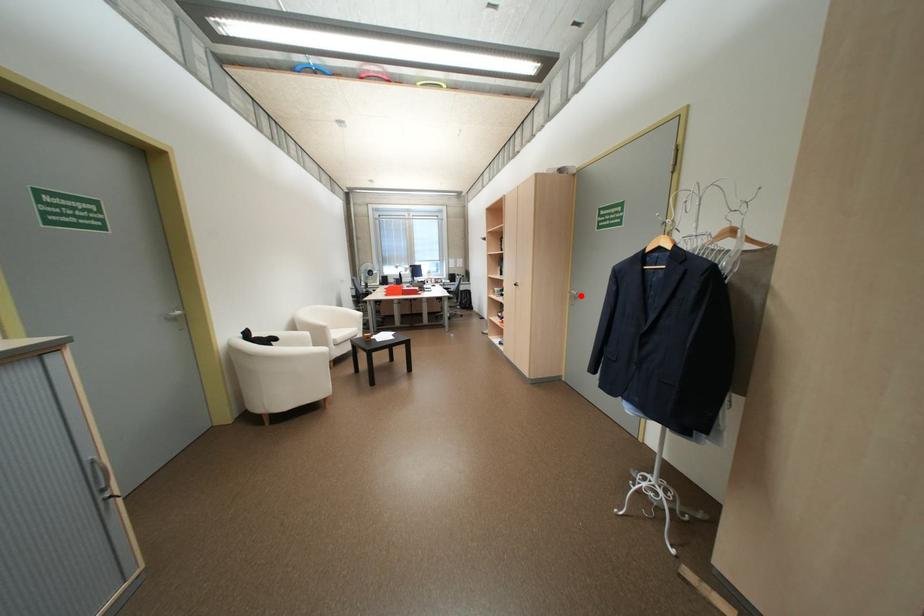
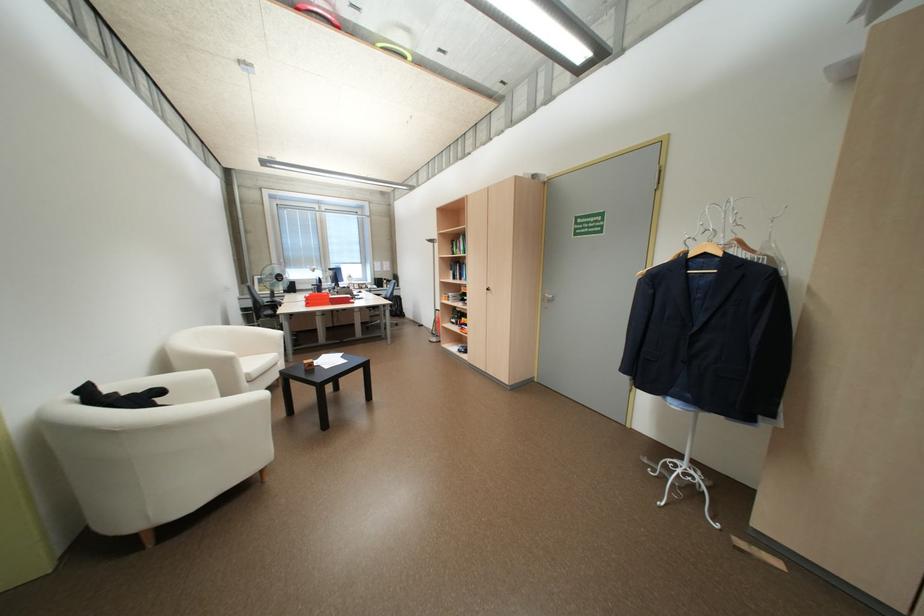
The point at the highlighted location is marked in the first image. Where is the corresponding point in the second image?

(553, 299)